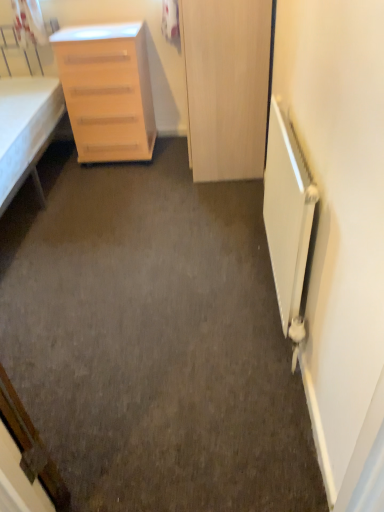
The height and width of the screenshot is (512, 384). Find the location of `vacant space that's between wooden door at center and white matte radiator at right`. vacant space that's between wooden door at center and white matte radiator at right is located at coordinates (233, 240).